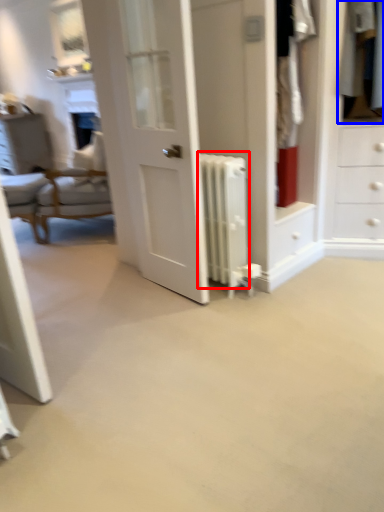
Question: Which object appears farthest to the camera in this image, radiator (highlighted by a red box) or clothing (highlighted by a blue box)?

Choices:
 (A) radiator
 (B) clothing

Answer: (B)